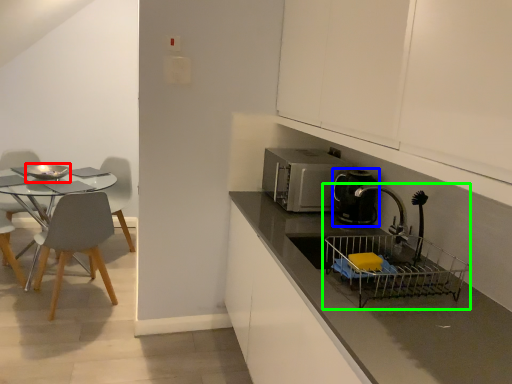
Question: Which object is positioned closest to appliance (highlighted by a red box)? Select from kitchen appliance (highlighted by a blue box) and sink (highlighted by a green box).

Choices:
 (A) kitchen appliance
 (B) sink

Answer: (A)